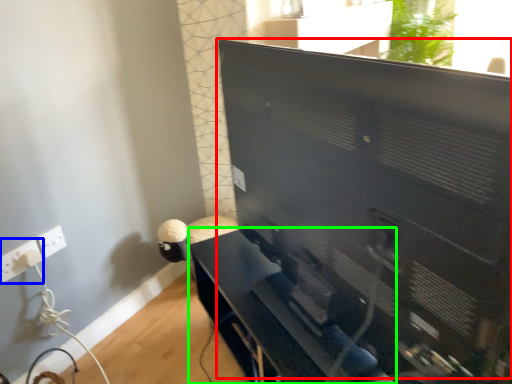
Question: Estimate the real-world distances between objects in this image. Which object is farther from computer monitor (highlighted by a red box), electric outlet (highlighted by a blue box) or furniture (highlighted by a green box)?

Choices:
 (A) electric outlet
 (B) furniture

Answer: (A)